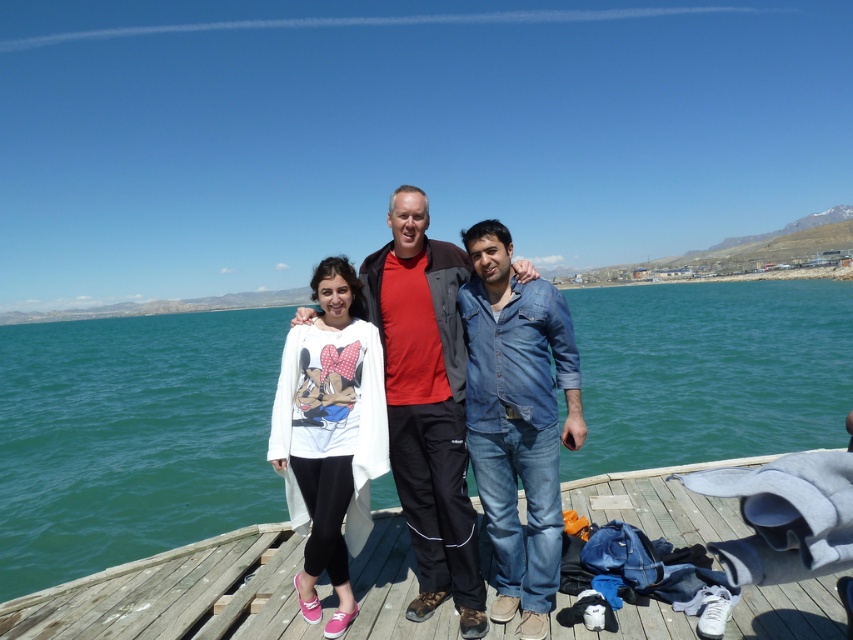
You are planning to take a photo of the green water at center and the wooden at center. Which object appears taller in the photo?

The green water at center appears taller than the wooden at center in the photo.

You are standing on the wooden dock and want to hand a life jacket to the person wearing the white matte shirt at center. You are currently holding the jacket and are 3 meters away from the denim jeans at lower right. Can you reach them without moving closer?

The denim jeans at lower right is 1.75 meters away from the white matte shirt at center. Since you are 3 meters away from the denim jeans at lower right, the total distance between you and the white matte shirt at center is 3 meters plus 1.75 meters, totaling 4.75 meters. This distance is likely too far to reach without moving closer.